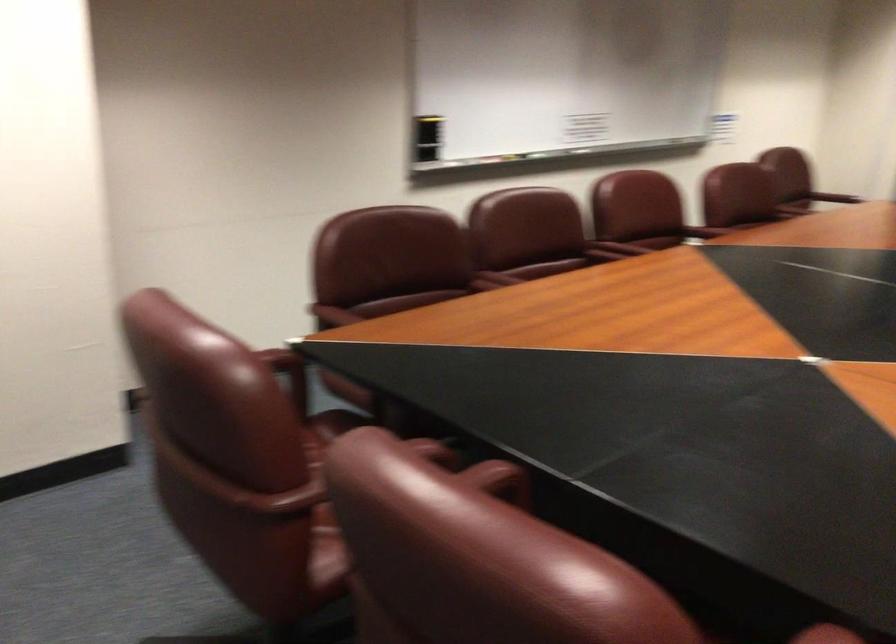
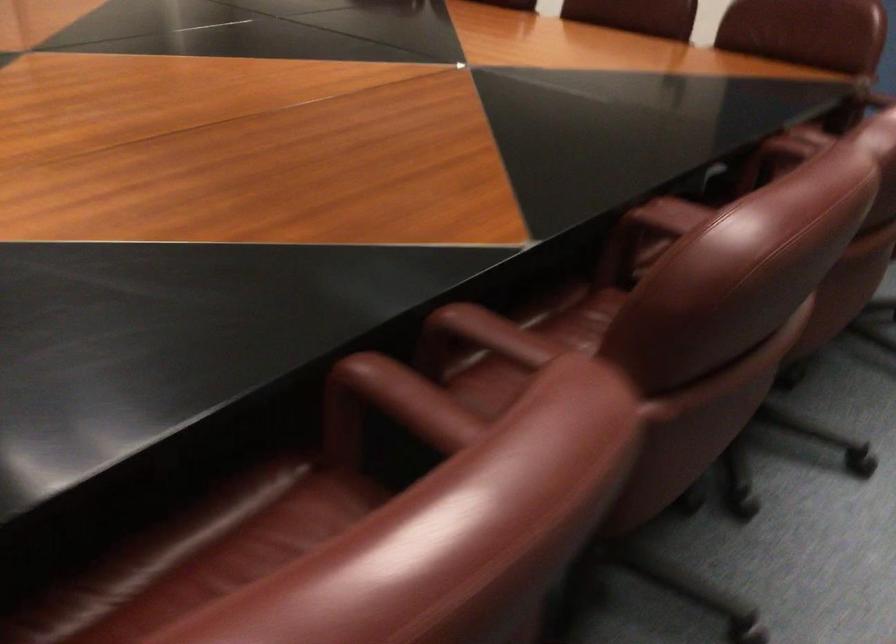
From the picture: Based on the continuous images, in which direction is the camera rotating?

The camera's rotation is toward right-down.